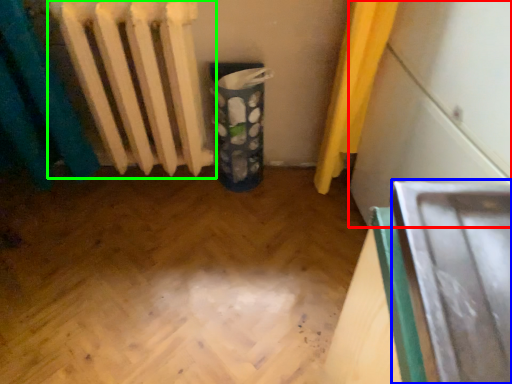
Question: Which object is positioned farthest from wide (highlighted by a red box)? Select from wide (highlighted by a blue box) and radiator (highlighted by a green box).

Choices:
 (A) wide
 (B) radiator

Answer: (B)